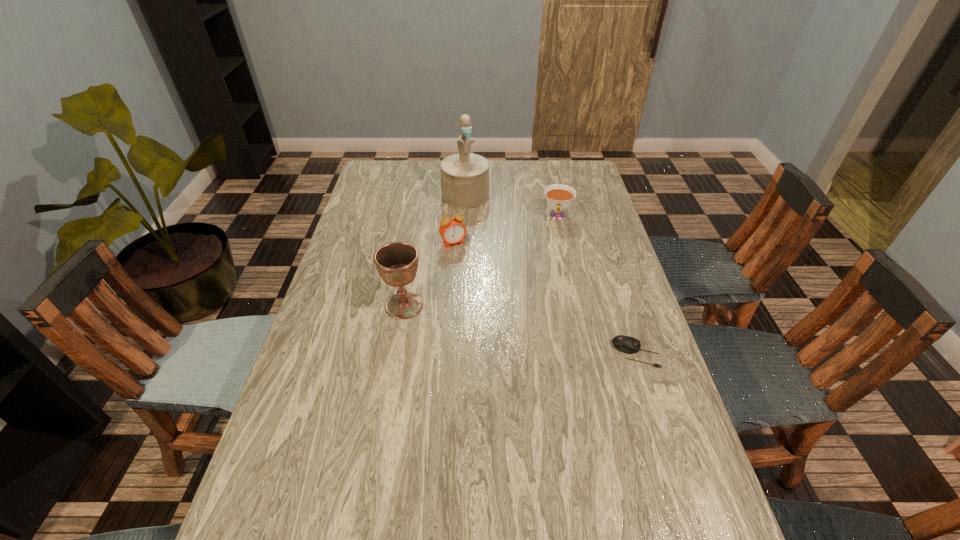
This screenshot has width=960, height=540. What are the coordinates of `free spot between the second tallest object and the tallest object` in the screenshot? It's located at (435, 251).

The image size is (960, 540). I want to click on vacant space in between the shortest object and the chalice, so click(x=520, y=329).

Find the location of a particular element. This screenshot has height=540, width=960. vacant area that lies between the rightmost object and the alarm clock is located at coordinates (545, 299).

Image resolution: width=960 pixels, height=540 pixels. Find the location of `free point between the tallest object and the second object from right to left`. free point between the tallest object and the second object from right to left is located at coordinates (512, 205).

You are a GUI agent. You are given a task and a screenshot of the screen. Output one action in this format:
    pyautogui.click(x=<x>, y=<y>)
    Task: Click on the free space between the figurine and the chalice
    This screenshot has width=960, height=540.
    Given the screenshot: What is the action you would take?
    pyautogui.click(x=435, y=251)

Where is `free space between the mouse and the fourth shortest object`? The width and height of the screenshot is (960, 540). free space between the mouse and the fourth shortest object is located at coordinates (520, 329).

This screenshot has height=540, width=960. Find the location of `vacant space that's between the leftmost object and the shortest object`. vacant space that's between the leftmost object and the shortest object is located at coordinates (520, 329).

Identify the location of vacant area that lies between the shortest object and the fourth object from left to right. (597, 285).

Point out which object is positioned as the fourth nearest to the nearest object. Please provide its 2D coordinates. Your answer should be formatted as a tuple, i.e. [(x, y)], where the tuple contains the x and y coordinates of a point satisfying the conditions above.

[(464, 176)]

At what (x,y) coordinates should I click in order to perform the action: click on object that stands as the fourth closest to the tallest object. Please return your answer as a coordinate pair (x, y). Looking at the image, I should click on (626, 344).